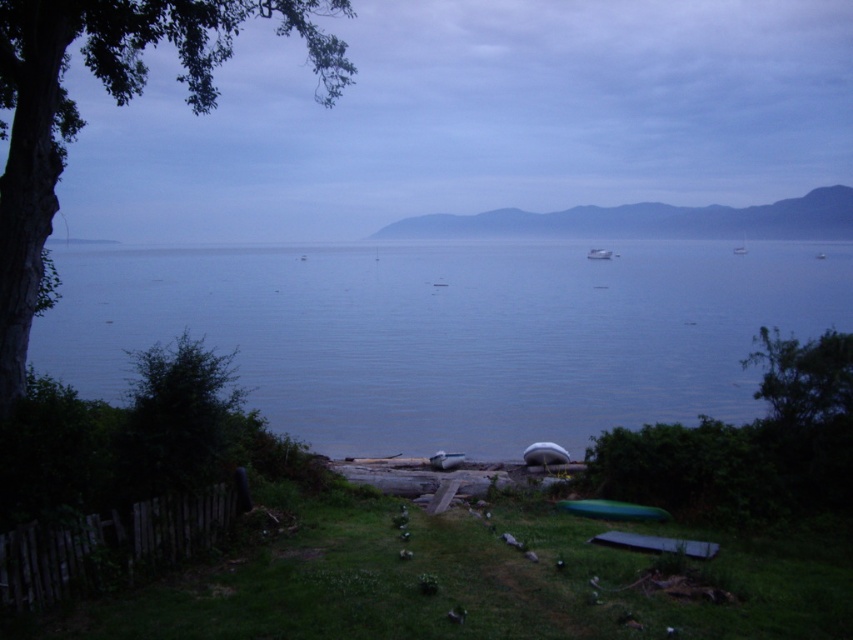
Does green leafy tree at left have a larger size compared to white rubber boat at center?

Yes.

Is green leafy tree at left positioned in front of white rubber boat at center?

Yes, it is in front of white rubber boat at center.

What do you see at coordinates (115, 104) in the screenshot?
I see `green leafy tree at left` at bounding box center [115, 104].

Find the location of a particular element. The image size is (853, 640). green leafy tree at left is located at coordinates (115, 104).

Describe the element at coordinates (445, 460) in the screenshot. This screenshot has width=853, height=640. I see `white matte boat at center` at that location.

Is white matte boat at center further to the viewer compared to white glossy boat at center?

No, it is in front of white glossy boat at center.

Measure the distance between point (457,456) and camera.

Point (457,456) is 13.39 meters away from camera.

Image resolution: width=853 pixels, height=640 pixels. I want to click on white matte boat at center, so click(445, 460).

Can you confirm if white rubber boat at center is thinner than white matte boat at center?

In fact, white rubber boat at center might be wider than white matte boat at center.

From the picture: Does white rubber boat at center have a larger size compared to white matte boat at center?

Indeed, white rubber boat at center has a larger size compared to white matte boat at center.

Where is `white rubber boat at center`? This screenshot has height=640, width=853. white rubber boat at center is located at coordinates (544, 454).